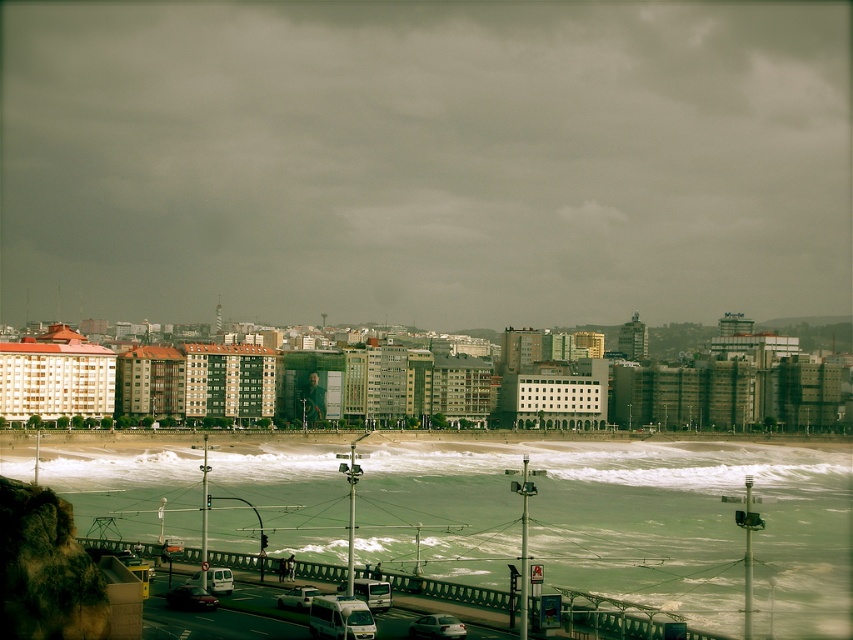
Measure the distance between matte silver car at center and camera.

matte silver car at center and camera are 75.20 meters apart.

Is matte silver car at center taller than shiny silver car at lower left?

No, matte silver car at center is not taller than shiny silver car at lower left.

Does point (418, 636) come farther from viewer compared to point (183, 596)?

No, it is not.

Locate an element on the screen. This screenshot has width=853, height=640. matte silver car at center is located at coordinates (437, 627).

Is dark gray clouds at upper center bigger than white matte van at lower center?

Yes, dark gray clouds at upper center is bigger than white matte van at lower center.

Measure the distance between dark gray clouds at upper center and camera.

373.33 meters

You are a GUI agent. You are given a task and a screenshot of the screen. Output one action in this format:
    pyautogui.click(x=<x>, y=<y>)
    Task: Click on the dark gray clouds at upper center
    This screenshot has height=640, width=853.
    Given the screenshot: What is the action you would take?
    click(424, 161)

Does dark gray clouds at upper center have a larger size compared to matte silver car at center?

Correct, dark gray clouds at upper center is larger in size than matte silver car at center.

Can you confirm if dark gray clouds at upper center is taller than matte silver car at center?

Correct, dark gray clouds at upper center is much taller as matte silver car at center.

Identify the location of dark gray clouds at upper center. (424, 161).

The height and width of the screenshot is (640, 853). Find the location of `dark gray clouds at upper center`. dark gray clouds at upper center is located at coordinates (424, 161).